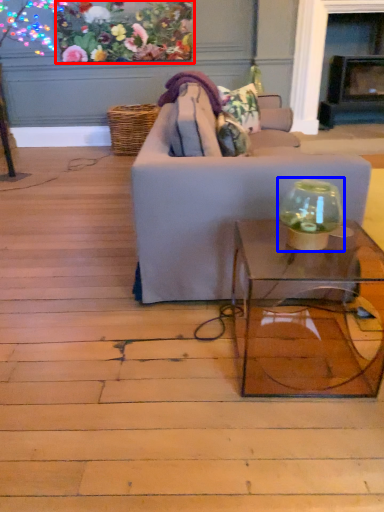
Question: Which point is closer to the camera, floral arrangement (highlighted by a red box) or glass vase (highlighted by a blue box)?

Choices:
 (A) floral arrangement
 (B) glass vase

Answer: (B)